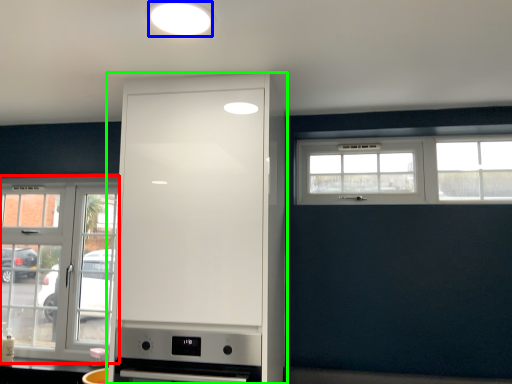
Question: Considering the real-world distances, which object is farthest from window (highlighted by a red box)? lighting (highlighted by a blue box) or cabinetry (highlighted by a green box)?

Choices:
 (A) lighting
 (B) cabinetry

Answer: (A)